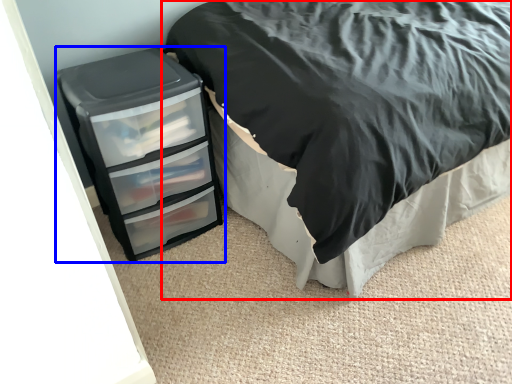
Question: Which object is closer to the camera taking this photo, bed (highlighted by a red box) or chest of drawers (highlighted by a blue box)?

Choices:
 (A) bed
 (B) chest of drawers

Answer: (A)